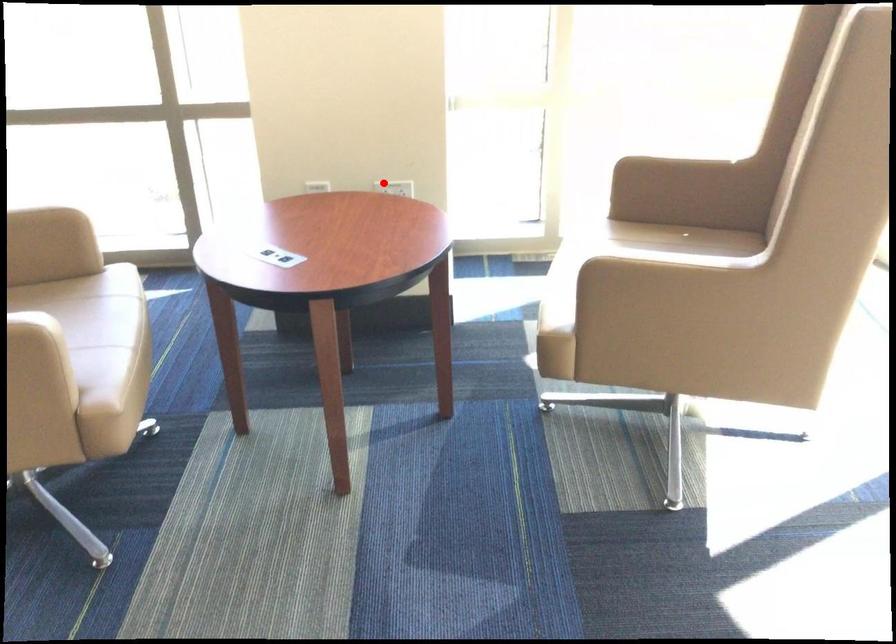
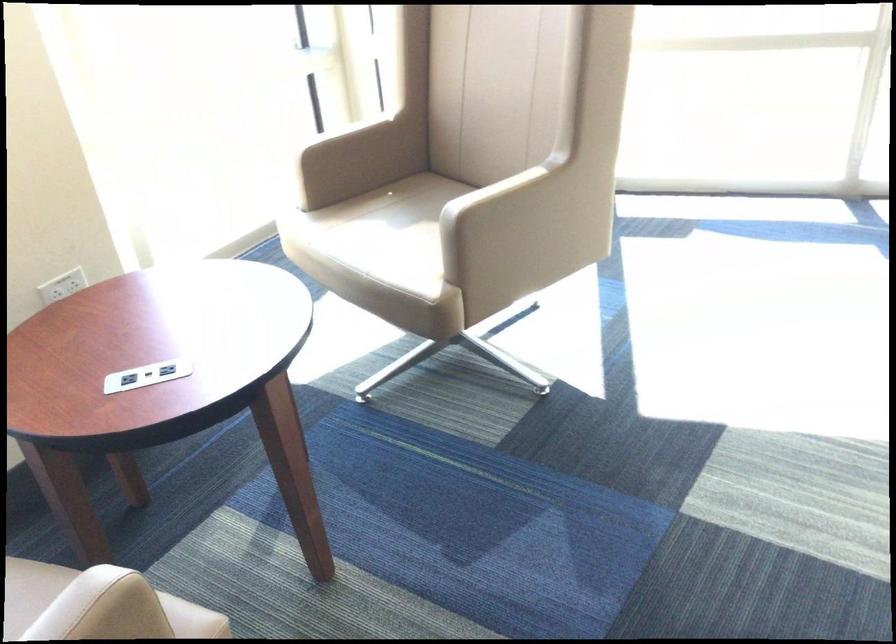
Question: I am providing you with two images of the same scene from different viewpoints. In image1, a red point is highlighted. Considering the same 3D point in image2, which of the following is correct?

Choices:
 (A) It is closer
 (B) It is farther

Answer: (A)